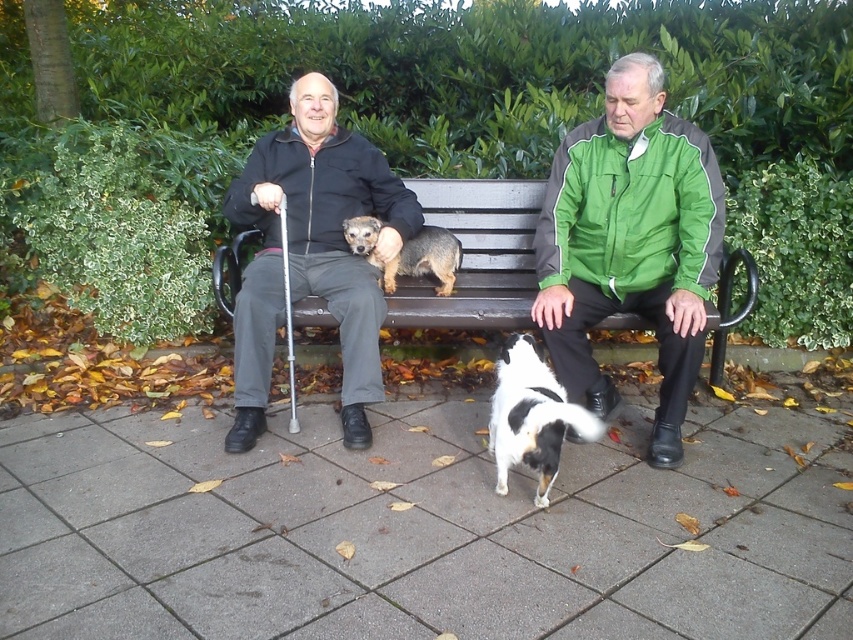
You are a photographer trying to capture a photo of both the wooden bench at center and the brown textured dog at center. Since you want to include both in the frame, which object should you position closer to the camera to ensure both are visible?

The wooden bench at center is to the right of brown textured dog at center, so you should position the brown textured dog at center closer to the camera to ensure both are visible in the frame.

You are a delivery person standing in front of the bench. You need to deliver a package to the person wearing the matte black jacket at center. The package is 1.5 meters long. Can you hand over the package without moving from your current position?

The matte black jacket at center and viewer are 2.32 meters apart. The package is 1.5 meters long, so you can hand over the package as the distance between you is within the package length.

You are a photographer trying to capture a closeup of the black and white dog standing near the bench. You notice a point at coordinate [630,243] on the image. What object is this point located on?

The point at coordinate [630,243] is located on the green fabric jacket at right.